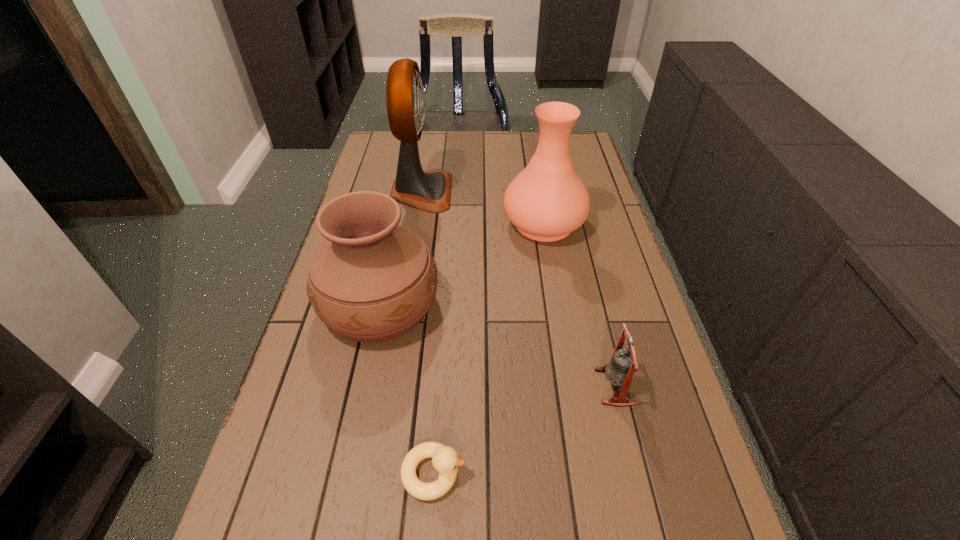
Where is `the tallest object`? The width and height of the screenshot is (960, 540). the tallest object is located at coordinates pos(430,191).

You are a GUI agent. You are given a task and a screenshot of the screen. Output one action in this format:
    pyautogui.click(x=<x>, y=<y>)
    Task: Click on the fourth shortest object
    
    Given the screenshot: What is the action you would take?
    pyautogui.click(x=547, y=201)

The height and width of the screenshot is (540, 960). In order to click on the third shortest object in this screenshot , I will do `click(372, 280)`.

The image size is (960, 540). What are the coordinates of `urn` in the screenshot? It's located at (372, 280).

Locate an element on the screen. The image size is (960, 540). bell is located at coordinates (621, 370).

This screenshot has width=960, height=540. In order to click on the second nearest object in this screenshot , I will do `click(621, 370)`.

Find the location of `the nearest object`. the nearest object is located at coordinates tap(445, 459).

Image resolution: width=960 pixels, height=540 pixels. Find the location of `duckling`. duckling is located at coordinates (445, 459).

Find the location of `vacant space located 0.170m on the front-facing side of the fan`. vacant space located 0.170m on the front-facing side of the fan is located at coordinates (504, 192).

The height and width of the screenshot is (540, 960). In order to click on free space located on the left of the fourth shortest object in this screenshot , I will do `click(439, 223)`.